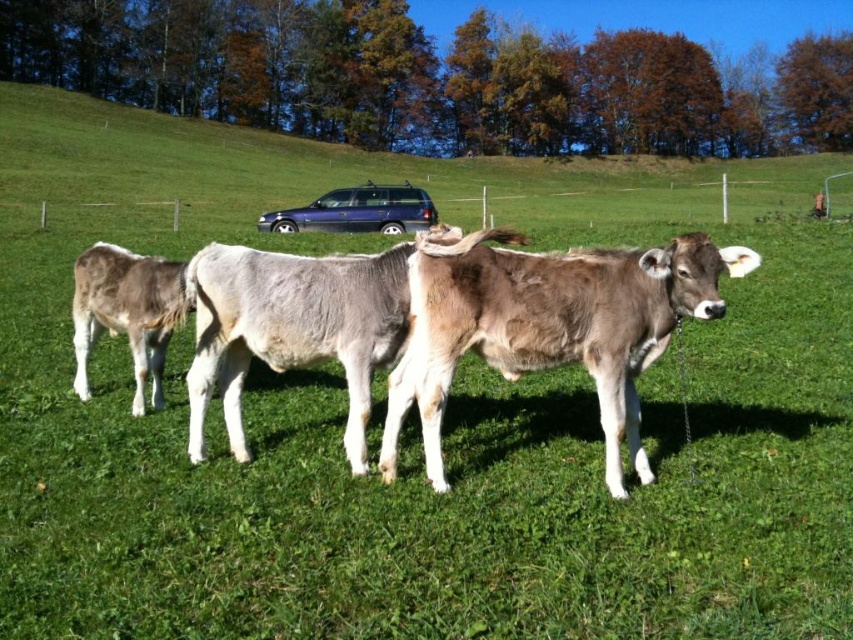
You are a farmer checking the pasture. You notice the brown fuzzy cow at center and the gray smooth calf at left. Which animal is located above the other?

The brown fuzzy cow at center is positioned under the gray smooth calf at left, meaning the gray smooth calf at left is above the brown fuzzy cow at center.

You are a farmer trying to locate the cow in the center of the pasture. The pasture is represented by a coordinate system where the bottom left corner is the origin point. The coordinates of the cow are given as point (549, 326). Can you determine if the cow is closer to the top or bottom edge of the pasture?

The cow represented by point (549, 326) is closer to the top edge of the pasture since its y coordinate is 0.645, which is more than half of the pasture height.

You are a farmer checking the pasture. You see the brown fuzzy cow at center and the brown matte cow at center. Which cow is closer to the trees with autumnal foliage?

The brown matte cow at center is closer to the trees with autumnal foliage because it is larger than the brown fuzzy cow at center.